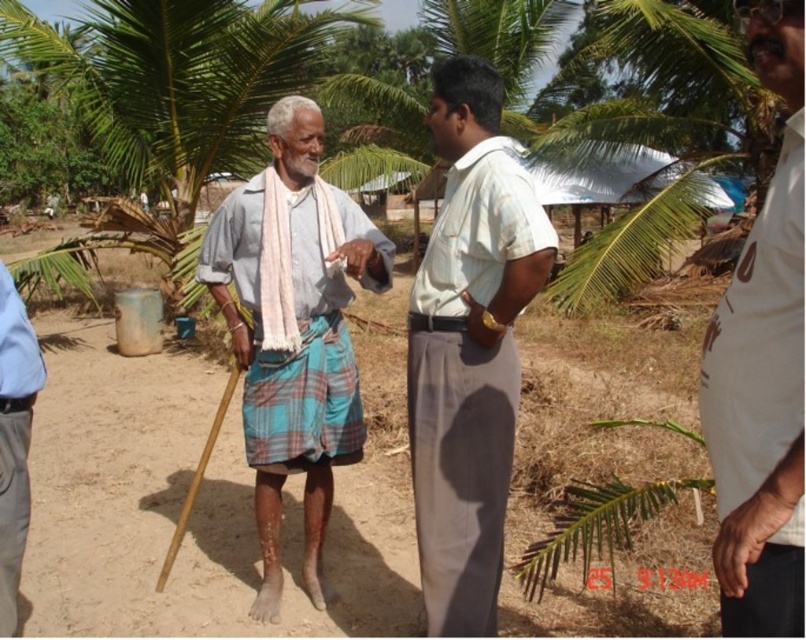
Question: Can you confirm if white smooth shirt at center is positioned above white dotted shirt at center?

Choices:
 (A) no
 (B) yes

Answer: (A)

Question: Does light blue plaid cloth at center come in front of light blue fabric pants at lower left?

Choices:
 (A) no
 (B) yes

Answer: (A)

Question: Among these objects, which one is nearest to the camera?

Choices:
 (A) light blue plaid cloth at center
 (B) green leafy palm tree at center
 (C) white dotted shirt at center
 (D) light blue fabric pants at lower left

Answer: (C)

Question: Does white dotted shirt at center appear over blue plaid kilt at center?

Choices:
 (A) no
 (B) yes

Answer: (B)

Question: Which object is the farthest from the white dotted shirt at center?

Choices:
 (A) blue plaid kilt at center
 (B) light blue fabric pants at lower left
 (C) green leafy palm tree at center
 (D) light blue plaid cloth at center

Answer: (C)

Question: Which object is farther from the camera taking this photo?

Choices:
 (A) white dotted shirt at center
 (B) white smooth shirt at center
 (C) green leafy palm tree at center

Answer: (C)